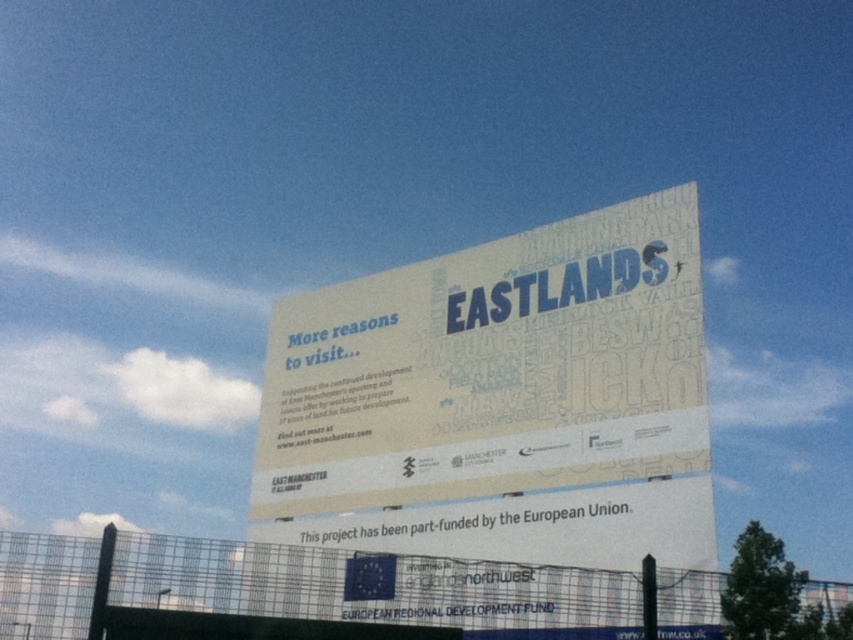
Can you confirm if white paper billboard at center is positioned to the right of metal mesh fence at lower center?

Indeed, white paper billboard at center is positioned on the right side of metal mesh fence at lower center.

Is the position of white paper billboard at center less distant than that of metal mesh fence at lower center?

No, white paper billboard at center is further to the viewer.

Image resolution: width=853 pixels, height=640 pixels. Find the location of `white paper billboard at center`. white paper billboard at center is located at coordinates (505, 406).